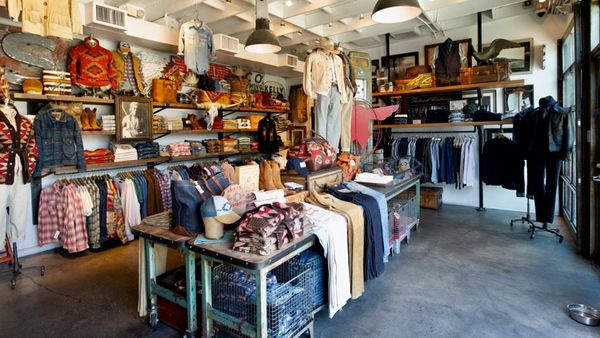
You are a GUI agent. You are given a task and a screenshot of the screen. Output one action in this format:
    pyautogui.click(x=<x>, y=<y>)
    Task: Click on the desk
    This screenshot has height=338, width=600.
    Given the screenshot: What is the action you would take?
    pyautogui.click(x=277, y=257)